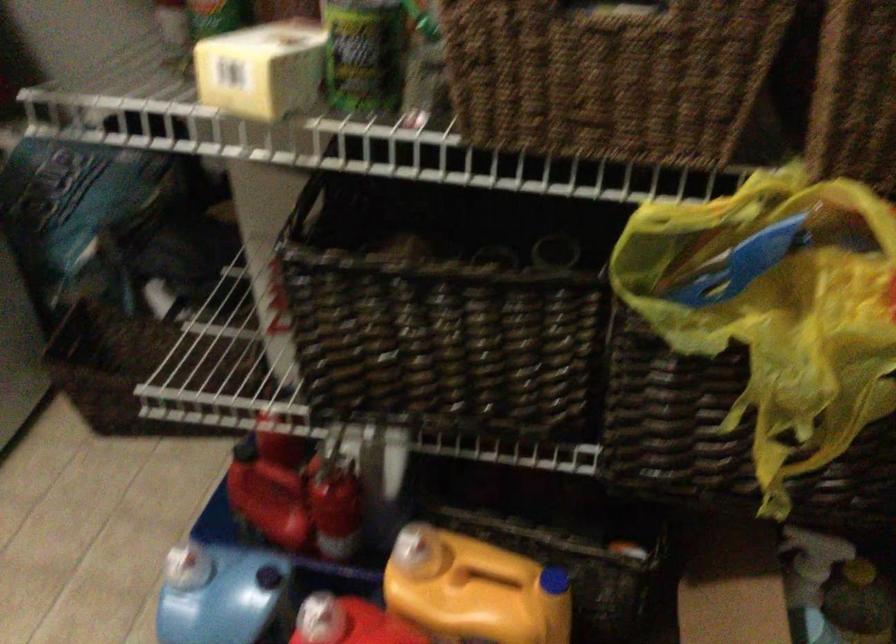
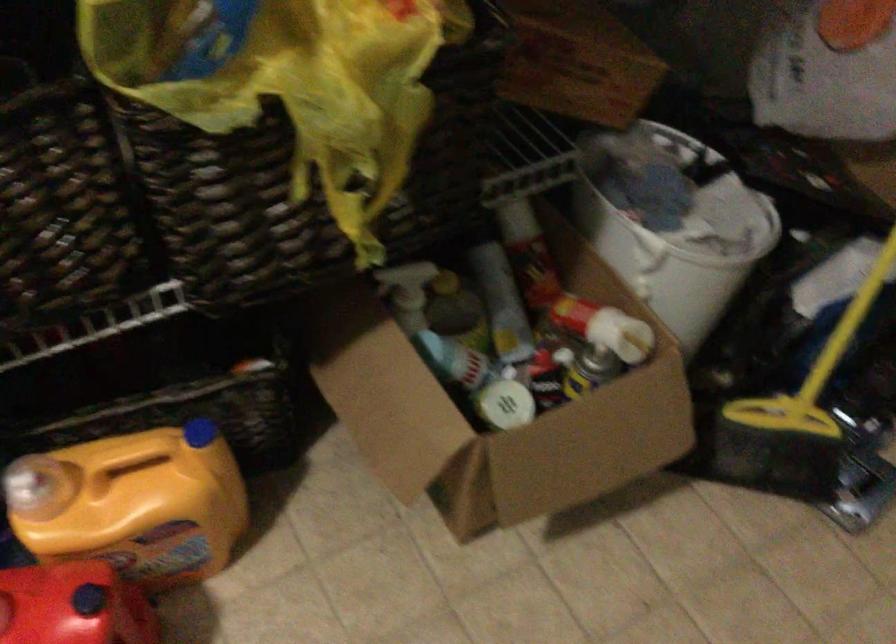
Find the pixel in the second image that matches [790,339] in the first image.

(323, 84)